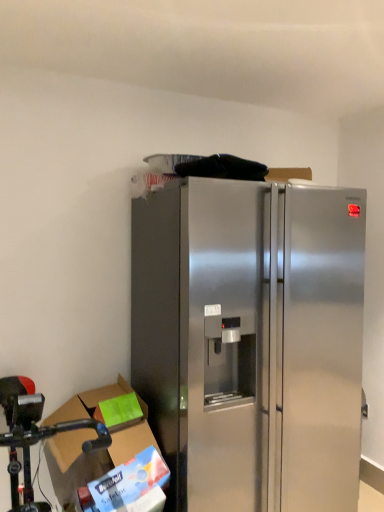
Question: From the image's perspective, is cardboard box at lower left positioned above or below stainless steel refrigerator at center?

Choices:
 (A) above
 (B) below

Answer: (B)

Question: Does point (120, 436) appear closer or farther from the camera than point (198, 195)?

Choices:
 (A) farther
 (B) closer

Answer: (A)

Question: Which object is positioned farthest from the stainless steel fridge at lower left?

Choices:
 (A) stainless steel refrigerator at center
 (B) cardboard box at lower left

Answer: (A)

Question: Which object is the closest to the stainless steel refrigerator at center?

Choices:
 (A) stainless steel fridge at lower left
 (B) cardboard box at lower left

Answer: (B)